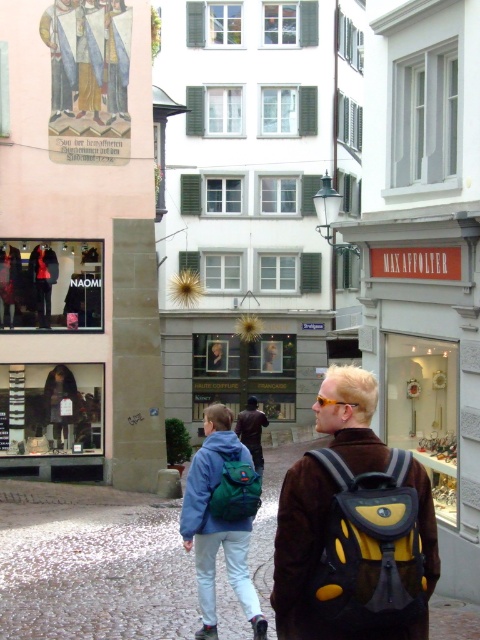
Question: Does yellow fabric backpack at center come behind dark brown leather jacket at center?

Choices:
 (A) yes
 (B) no

Answer: (B)

Question: Which object is positioned farthest from the matte green backpack at center?

Choices:
 (A) dark brown leather jacket at center
 (B) yellow fabric backpack at center
 (C) green fabric backpack at center

Answer: (A)

Question: Which object is farther from the camera taking this photo?

Choices:
 (A) dark brown leather jacket at center
 (B) matte green backpack at center
 (C) yellow fabric backpack at center

Answer: (A)

Question: Can you confirm if matte green backpack at center is wider than green fabric backpack at center?

Choices:
 (A) no
 (B) yes

Answer: (B)

Question: Which point is closer to the camera taking this photo?

Choices:
 (A) (338, 589)
 (B) (243, 442)
 (C) (210, 442)
 (D) (226, 470)

Answer: (A)

Question: Can you confirm if matte green backpack at center is smaller than dark brown leather jacket at center?

Choices:
 (A) yes
 (B) no

Answer: (B)